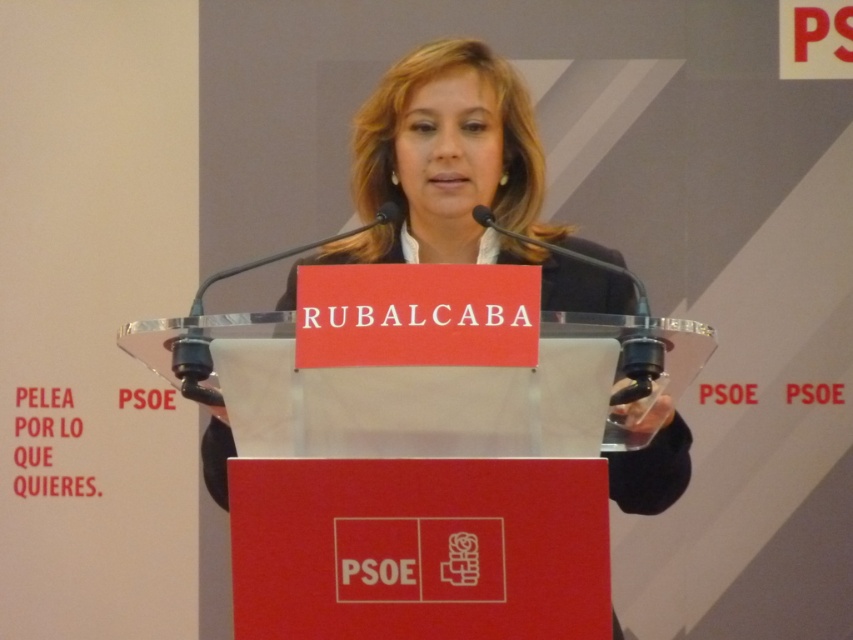
Can you confirm if matte black suit at center is taller than transparent plastic podium at center?

Correct, matte black suit at center is much taller as transparent plastic podium at center.

Is point (447, 204) more distant than point (544, 324)?

Yes, it is behind point (544, 324).

Is point (437, 68) closer to viewer compared to point (196, 317)?

No, (437, 68) is further to viewer.

Image resolution: width=853 pixels, height=640 pixels. What are the coordinates of `matte black suit at center` in the screenshot? It's located at point(462,179).